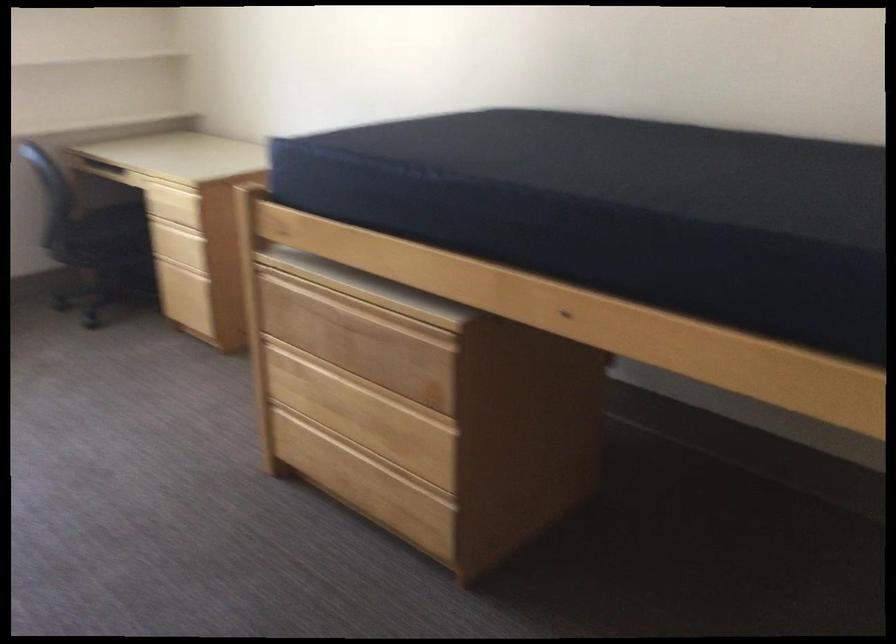
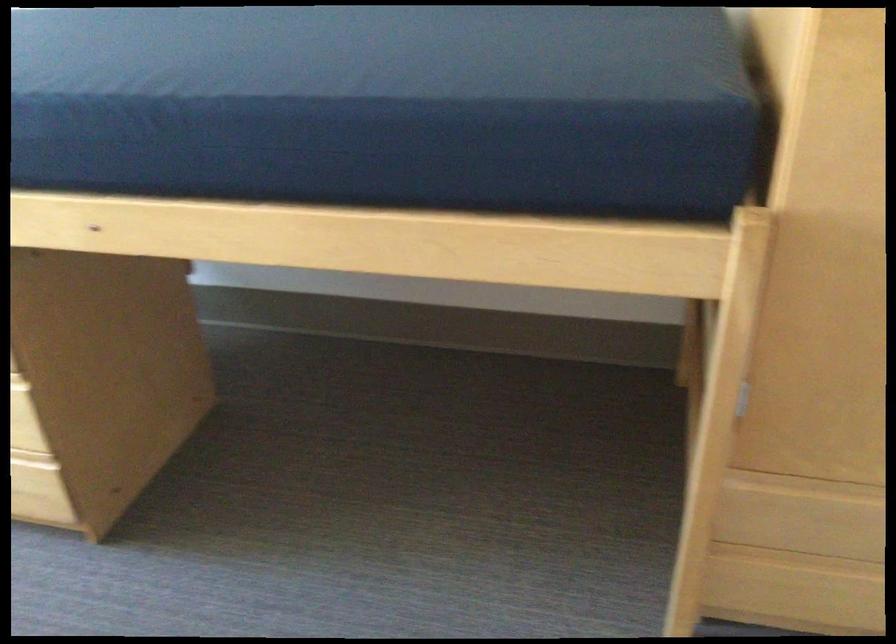
Question: Which direction would the cameraman need to move to produce the second image? Reply with the corresponding letter.

Choices:
 (A) Left
 (B) Right
 (C) Forward
 (D) Backward

Answer: (B)